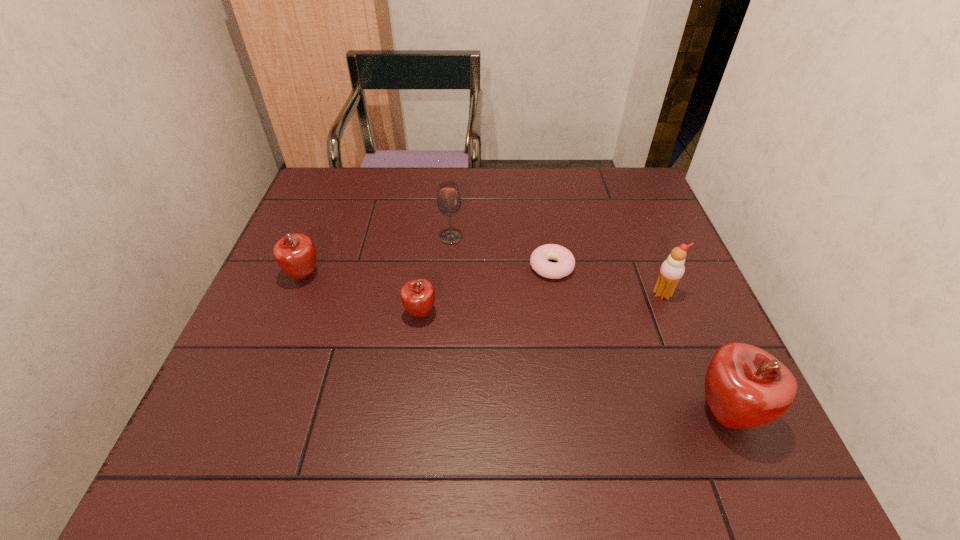
Find the location of a particular element. free point that satisfies the following two spatial constraints: 1. at the front with a straw on the tallest apple; 2. on the right side of the icecream is located at coordinates (710, 414).

At what (x,y) coordinates should I click in order to perform the action: click on vacant point that satisfies the following two spatial constraints: 1. on the back side of the farthest object; 2. on the right side of the shortest apple. Please return your answer as a coordinate pair (x, y). This screenshot has width=960, height=540. Looking at the image, I should click on (430, 238).